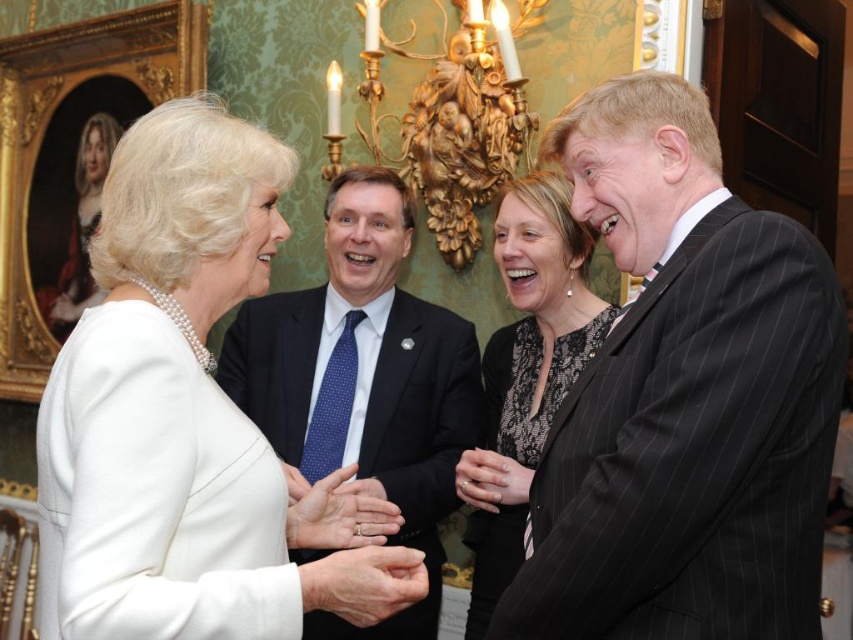
Does white pearl necklace at upper left have a greater width compared to white pearl ring at center?

Correct, the width of white pearl necklace at upper left exceeds that of white pearl ring at center.

Who is positioned more to the right, white pearl necklace at upper left or white pearl ring at center?

From the viewer's perspective, white pearl ring at center appears more on the right side.

Is point (258, 241) positioned behind point (526, 483)?

No, it is in front of (526, 483).

Locate an element on the screen. Image resolution: width=853 pixels, height=640 pixels. white pearl necklace at upper left is located at coordinates (189, 419).

Based on the photo, who is lower down, white pearl necklace at upper left or black lace dress at center?

Positioned lower is white pearl necklace at upper left.

Locate an element on the screen. white pearl necklace at upper left is located at coordinates (189, 419).

Between point (177, 628) and point (83, 202), which one is positioned in front?

Point (177, 628)

Can you confirm if white pearl necklace at upper left is positioned to the right of smooth pearl necklace at upper left?

Yes, white pearl necklace at upper left is to the right of smooth pearl necklace at upper left.

Is point (177, 534) positioned after point (78, 196)?

No, it is not.

This screenshot has width=853, height=640. I want to click on white pearl necklace at upper left, so click(x=189, y=419).